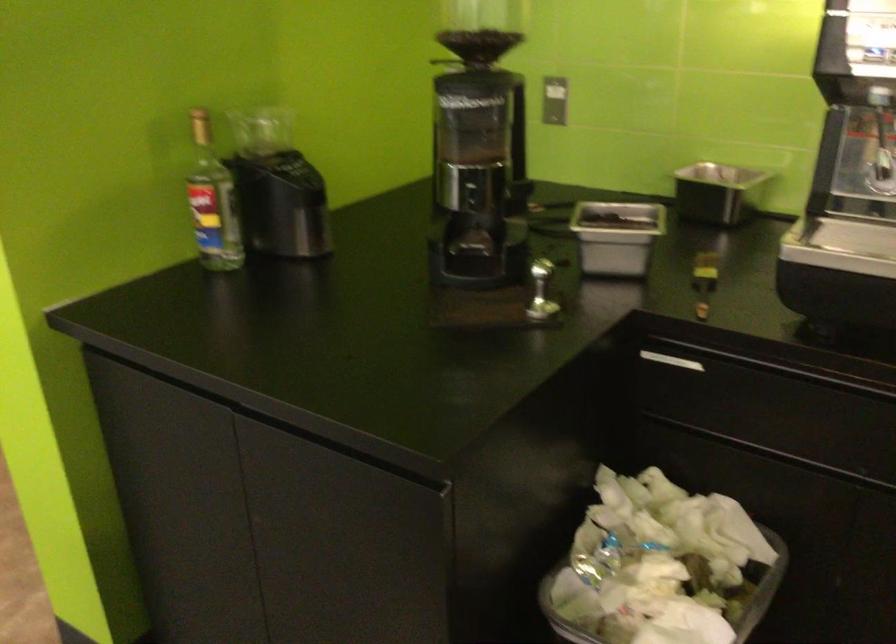
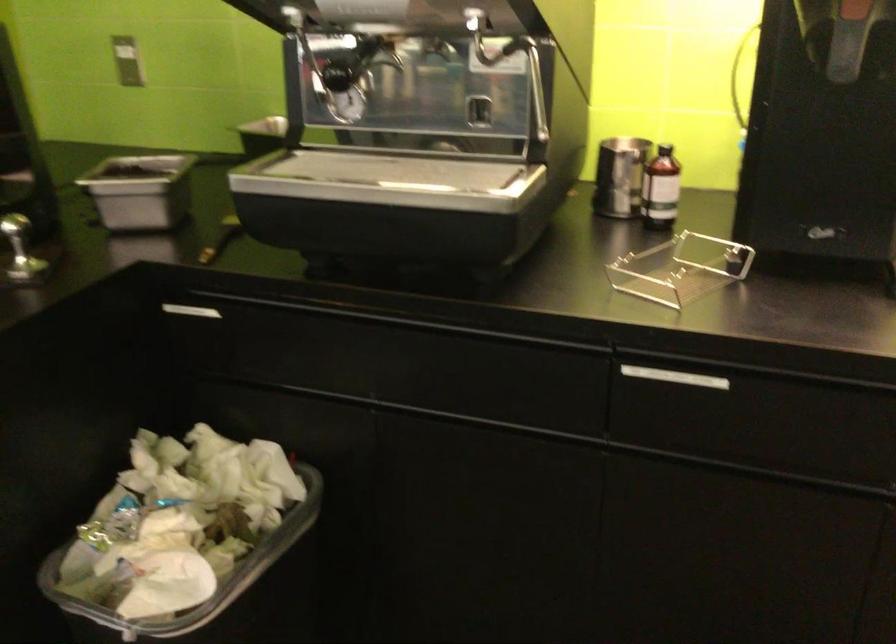
The point at (666, 359) is marked in the first image. Where is the corresponding point in the second image?

(192, 310)